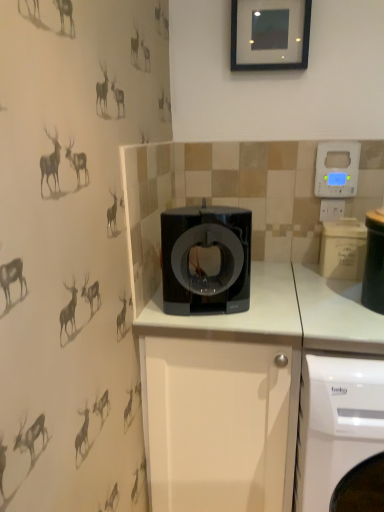
The image size is (384, 512). Identify the location of free location to the right of black glossy coffee machine at center. (268, 306).